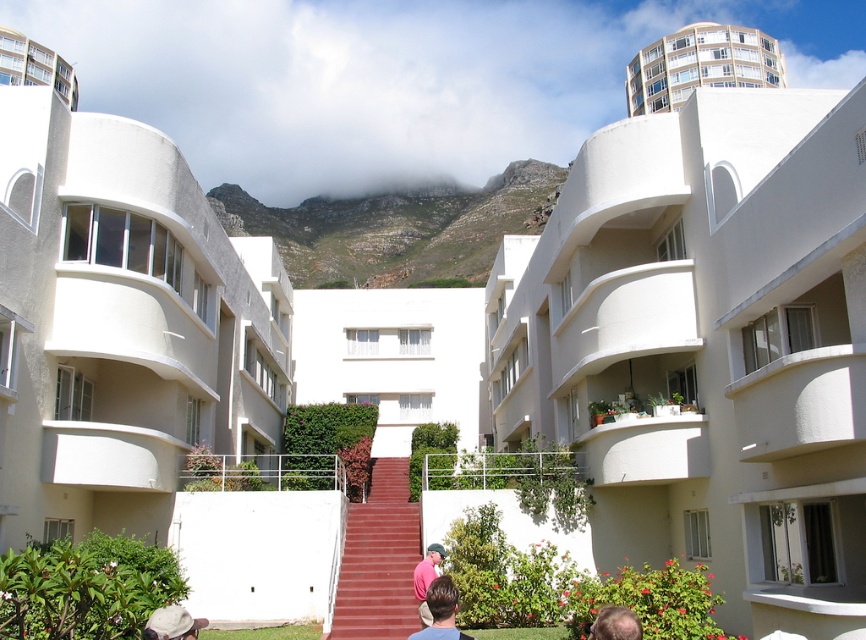
Question: Which object is the farthest from the light brown hair at lower center?

Choices:
 (A) white fabric hat at lower left
 (B) white smooth building at upper center
 (C) white matte building at center
 (D) pink fabric shirt at center

Answer: (C)

Question: In this image, where is white smooth building at upper left located relative to white glossy balcony at upper left?

Choices:
 (A) above
 (B) below

Answer: (B)

Question: Estimate the real-world distances between objects in this image. Which object is closer to the white glossy building at upper center?

Choices:
 (A) white matte building at center
 (B) white glossy balcony at upper left
 (C) light brown hair at lower center

Answer: (A)

Question: Can you confirm if brown hair at center is wider than light brown hair at lower center?

Choices:
 (A) yes
 (B) no

Answer: (A)

Question: Which of the following is the farthest from the observer?

Choices:
 (A) white glossy building at upper center
 (B) pink fabric shirt at center
 (C) white smooth building at upper center
 (D) white glossy balcony at upper left

Answer: (A)

Question: Can you confirm if white fabric hat at lower left is positioned above pink fabric shirt at center?

Choices:
 (A) yes
 (B) no

Answer: (B)